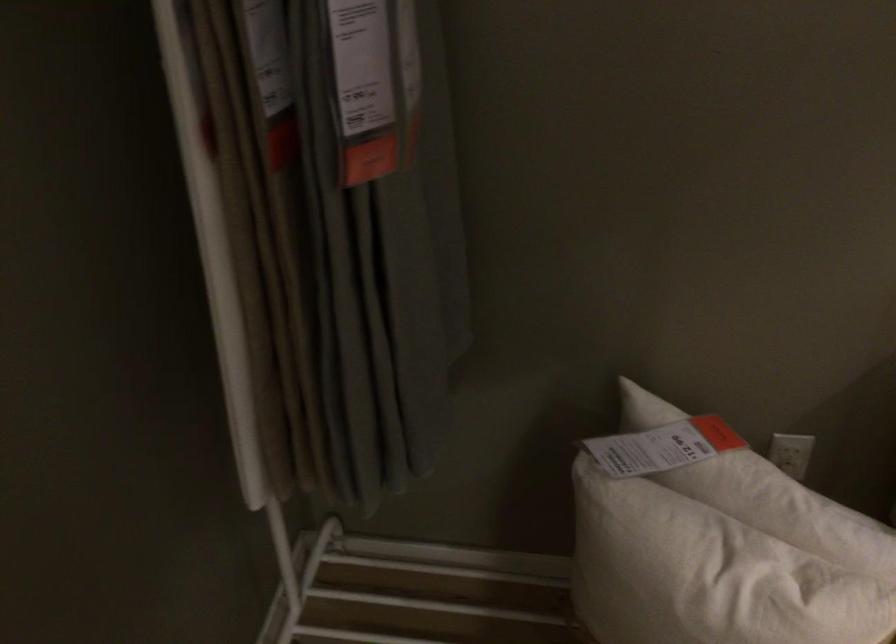
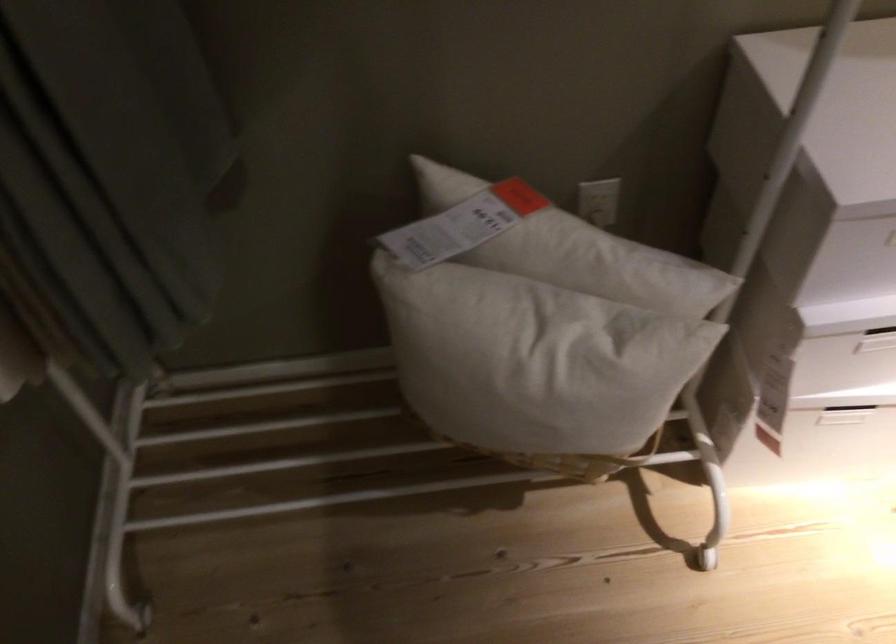
Where in the second image is the point corresponding to point (795, 460) from the first image?

(598, 207)